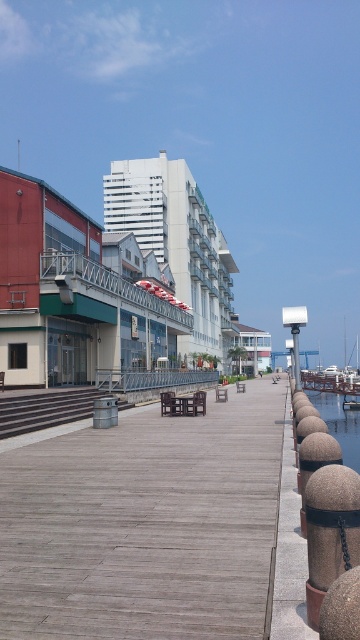
Question: Does white glossy building at center appear on the right side of clear water at lower right?

Choices:
 (A) yes
 (B) no

Answer: (B)

Question: Which of the following is the farthest from the observer?

Choices:
 (A) (59, 256)
 (B) (174, 179)

Answer: (B)

Question: Can you confirm if white glossy building at center is positioned to the left of wooden dock at center?

Choices:
 (A) no
 (B) yes

Answer: (B)

Question: Which point is farther to the camera?

Choices:
 (A) [340, 396]
 (B) [162, 378]
 (C) [159, 216]

Answer: (C)

Question: Which point appears farthest from the camera in this image?

Choices:
 (A) (106, 323)
 (B) (150, 246)
 (C) (119, 371)
 (D) (345, 440)

Answer: (B)

Question: Does white glossy building at center have a larger size compared to clear water at lower right?

Choices:
 (A) yes
 (B) no

Answer: (A)